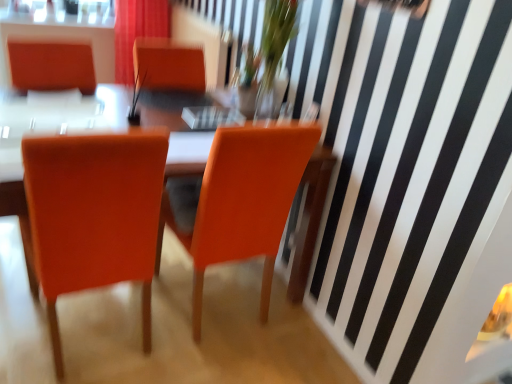
Image resolution: width=512 pixels, height=384 pixels. What do you see at coordinates (94, 214) in the screenshot?
I see `matte orange chair at center, the second chair positioned from the right` at bounding box center [94, 214].

Where is `matte red curtain at upper center`? This screenshot has height=384, width=512. matte red curtain at upper center is located at coordinates tap(137, 31).

What do you see at coordinates (242, 202) in the screenshot? I see `orange leather chair at center, the 2th chair positioned from the left` at bounding box center [242, 202].

This screenshot has width=512, height=384. Describe the element at coordinates (310, 218) in the screenshot. I see `matte orange table at center` at that location.

Find the location of `matte orange chair at center, the second chair positioned from the right`. matte orange chair at center, the second chair positioned from the right is located at coordinates (94, 214).

Is clear glass vase at upper center positioned beyond the bounds of matte orange chair at center, placed as the first chair when sorted from left to right?

Absolutely, clear glass vase at upper center is external to matte orange chair at center, placed as the first chair when sorted from left to right.

Between clear glass vase at upper center and matte orange chair at center, placed as the first chair when sorted from left to right, which one is positioned behind?

clear glass vase at upper center is further away from the camera.

Image resolution: width=512 pixels, height=384 pixels. I want to click on glass vase above the matte orange chair at center, placed as the first chair when sorted from left to right (from the image's perspective), so click(x=271, y=96).

Which of these two, orange leather chair at center, the 2th chair positioned from the left, or matte orange chair at center, the second chair positioned from the right, is bigger?

With larger size is matte orange chair at center, the second chair positioned from the right.

Can you confirm if orange leather chair at center, marked as the 1th chair in a right-to-left arrangement, is positioned to the right of matte orange chair at center, the second chair positioned from the right?

Yes.

Locate an element on the screen. This screenshot has height=384, width=512. chair above the matte orange chair at center, placed as the first chair when sorted from left to right (from a real-world perspective) is located at coordinates (242, 202).

Considering the relative sizes of orange leather chair at center, the 2th chair positioned from the left, and matte orange chair at center, placed as the first chair when sorted from left to right, in the image provided, is orange leather chair at center, the 2th chair positioned from the left, shorter than matte orange chair at center, placed as the first chair when sorted from left to right,?

In fact, orange leather chair at center, the 2th chair positioned from the left, may be taller than matte orange chair at center, placed as the first chair when sorted from left to right.

Between clear glass vase at upper center and matte orange table at center, which one has less height?

Standing shorter between the two is clear glass vase at upper center.

From a real-world perspective, which is physically above, clear glass vase at upper center or matte orange table at center?

In real-world perspective, clear glass vase at upper center is above.

Is clear glass vase at upper center bigger or smaller than matte orange table at center?

Considering their sizes, clear glass vase at upper center takes up less space than matte orange table at center.

Identify the location of table below the clear glass vase at upper center (from the image's perspective). (310, 218).

Considering the relative positions of clear glass vase at upper center and matte red curtain at upper center in the image provided, is clear glass vase at upper center to the left of matte red curtain at upper center from the viewer's perspective?

No.

Considering the sizes of objects clear glass vase at upper center and matte red curtain at upper center in the image provided, who is shorter, clear glass vase at upper center or matte red curtain at upper center?

With less height is clear glass vase at upper center.

Is clear glass vase at upper center in front of or behind matte red curtain at upper center in the image?

clear glass vase at upper center is positioned closer to the viewer than matte red curtain at upper center.

Is clear glass vase at upper center not within matte red curtain at upper center?

Yes, clear glass vase at upper center is not within matte red curtain at upper center.

From the image's perspective, is translucent glass vase at upper center above clear glass vase at upper center?

Correct, translucent glass vase at upper center appears higher than clear glass vase at upper center in the image.

From a real-world perspective, between translucent glass vase at upper center and clear glass vase at upper center, who is vertically lower?

clear glass vase at upper center, from a real-world perspective.

Is translucent glass vase at upper center thinner than clear glass vase at upper center?

No, translucent glass vase at upper center is not thinner than clear glass vase at upper center.

Image resolution: width=512 pixels, height=384 pixels. What are the coordinates of `glass vase on the right side of translucent glass vase at upper center` in the screenshot? It's located at (271, 96).

Considering the positions of points (303, 233) and (133, 12), is point (303, 233) closer to camera compared to point (133, 12)?

Yes, it is.

From the picture: Are matte orange table at center and matte red curtain at upper center beside each other?

No, matte orange table at center is not making contact with matte red curtain at upper center.

From a real-world perspective, is matte orange table at center positioned above or below matte red curtain at upper center?

In terms of real-world spatial position, matte orange table at center is below matte red curtain at upper center.

In the scene shown: Is clear glass vase at upper center far away from orange leather chair at center, the 2th chair positioned from the left?

clear glass vase at upper center is near orange leather chair at center, the 2th chair positioned from the left, not far away.

From the image's perspective, is clear glass vase at upper center located above or below orange leather chair at center, marked as the 1th chair in a right-to-left arrangement?

clear glass vase at upper center is situated higher than orange leather chair at center, marked as the 1th chair in a right-to-left arrangement, in the image.

How different are the orientations of clear glass vase at upper center and orange leather chair at center, the 2th chair positioned from the left, in degrees?

clear glass vase at upper center and orange leather chair at center, the 2th chair positioned from the left, are facing 90.2 degrees away from each other.

Which object is thinner, clear glass vase at upper center or orange leather chair at center, marked as the 1th chair in a right-to-left arrangement?

With smaller width is clear glass vase at upper center.

The width and height of the screenshot is (512, 384). Find the location of `glass vase behind the matte orange chair at center, the second chair positioned from the right`. glass vase behind the matte orange chair at center, the second chair positioned from the right is located at coordinates 271,96.

I want to click on chair in front of the orange leather chair at center, marked as the 1th chair in a right-to-left arrangement, so click(94, 214).

From the image, which object appears to be farther from orange leather chair at center, marked as the 1th chair in a right-to-left arrangement, clear glass vase at upper center or translucent glass vase at upper center?

clear glass vase at upper center is further to orange leather chair at center, marked as the 1th chair in a right-to-left arrangement.

From the picture: Which object lies nearer to the anchor point matte orange chair at center, the second chair positioned from the right, translucent glass vase at upper center or matte red curtain at upper center?

Based on the image, translucent glass vase at upper center appears to be nearer to matte orange chair at center, the second chair positioned from the right.

Considering their positions, is matte red curtain at upper center positioned further to clear glass vase at upper center than matte orange table at center?

Among the two, matte red curtain at upper center is located further to clear glass vase at upper center.

Which object lies further to the anchor point matte red curtain at upper center, clear glass vase at upper center or orange leather chair at center, marked as the 1th chair in a right-to-left arrangement?

orange leather chair at center, marked as the 1th chair in a right-to-left arrangement, is further to matte red curtain at upper center.

From the picture: Looking at the image, which one is located further to clear glass vase at upper center, matte orange table at center or translucent glass vase at upper center?

matte orange table at center lies further to clear glass vase at upper center than the other object.

Which object lies nearer to the anchor point orange leather chair at center, the 2th chair positioned from the left, matte orange chair at center, placed as the first chair when sorted from left to right, or translucent glass vase at upper center?

matte orange chair at center, placed as the first chair when sorted from left to right, is positioned closer to the anchor orange leather chair at center, the 2th chair positioned from the left.

Estimate the real-world distances between objects in this image. Which object is closer to matte red curtain at upper center, matte orange chair at center, placed as the first chair when sorted from left to right, or clear glass vase at upper center?

clear glass vase at upper center.

From the image, which object appears to be farther from translucent glass vase at upper center, matte orange chair at center, the second chair positioned from the right, or orange leather chair at center, marked as the 1th chair in a right-to-left arrangement?

matte orange chair at center, the second chair positioned from the right, is further to translucent glass vase at upper center.

Where is `table between matte orange chair at center, the second chair positioned from the right, and clear glass vase at upper center from front to back`? The height and width of the screenshot is (384, 512). table between matte orange chair at center, the second chair positioned from the right, and clear glass vase at upper center from front to back is located at coordinates (310, 218).

This screenshot has width=512, height=384. Identify the location of table situated between matte orange chair at center, the second chair positioned from the right, and orange leather chair at center, marked as the 1th chair in a right-to-left arrangement, from left to right. (310, 218).

Locate an element on the screen. floral arrangement between orange leather chair at center, marked as the 1th chair in a right-to-left arrangement, and matte red curtain at upper center in the front-back direction is located at coordinates (273, 52).

This screenshot has width=512, height=384. In order to click on glass vase positioned between translucent glass vase at upper center and matte red curtain at upper center from near to far in this screenshot , I will do `click(271, 96)`.